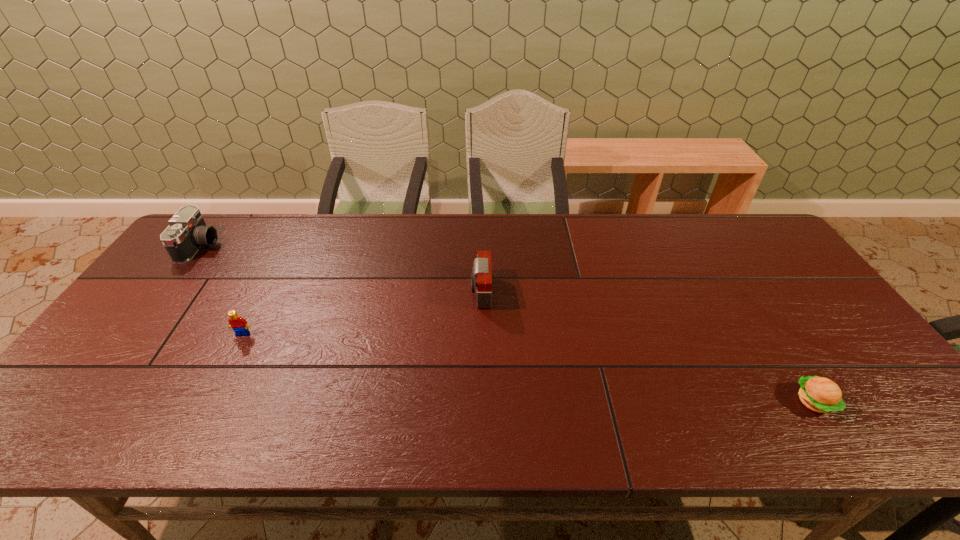
I want to click on vacant area situated 0.250m on the front-facing side of the third nearest object, so click(x=383, y=292).

Where is `vacant space situated on the front-facing side of the leftmost object`? vacant space situated on the front-facing side of the leftmost object is located at coordinates point(260,246).

Image resolution: width=960 pixels, height=540 pixels. What are the coordinates of `vacant space located 0.120m on the front-facing side of the third tallest object` in the screenshot? It's located at (222, 376).

You are a GUI agent. You are given a task and a screenshot of the screen. Output one action in this format:
    pyautogui.click(x=<x>, y=<y>)
    Task: Click on the free point located on the back of the rightmost object
    Image resolution: width=960 pixels, height=540 pixels.
    Given the screenshot: What is the action you would take?
    pyautogui.click(x=738, y=283)

Locate an element on the screen. Image resolution: width=960 pixels, height=540 pixels. object that is at the far edge is located at coordinates (187, 232).

The height and width of the screenshot is (540, 960). Identify the location of object at the near edge. (822, 395).

You are a GUI agent. You are given a task and a screenshot of the screen. Output one action in this format:
    pyautogui.click(x=<x>, y=<y>)
    Task: Click on the object present at the left edge
    The image size is (960, 540).
    Given the screenshot: What is the action you would take?
    pyautogui.click(x=187, y=232)

Where is `object positioned at the right edge`? object positioned at the right edge is located at coordinates (822, 395).

Find the location of a particular element. Image resolution: width=960 pixels, height=540 pixels. object that is at the far left corner is located at coordinates (187, 232).

Find the location of a particular element. Image resolution: width=960 pixels, height=540 pixels. object present at the near right corner is located at coordinates [822, 395].